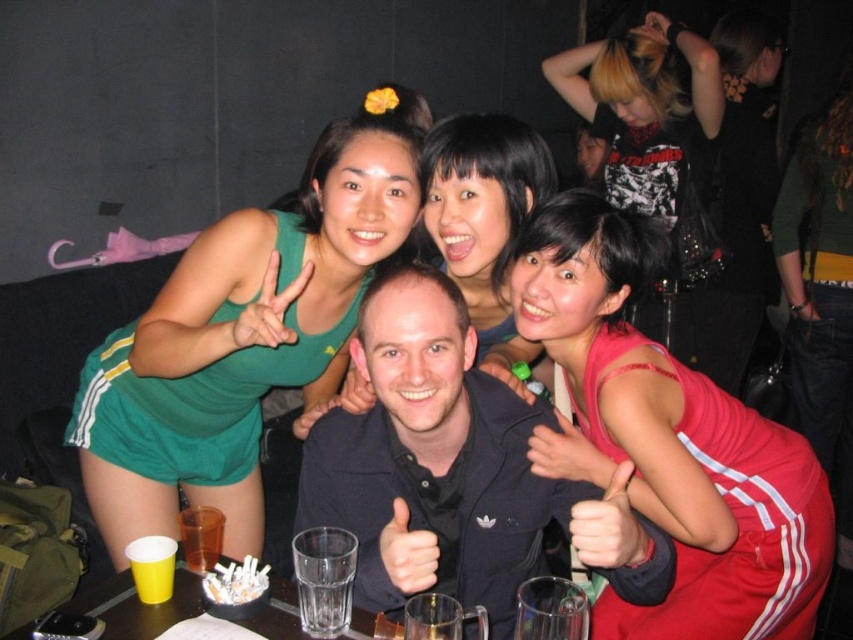
You are at the bar and want to take a photo of the red shiny dress at center. The bartender says you can only take the photo if you know its exact coordinates. What are the coordinates?

The coordinates of the red shiny dress at center are point (668,440).

From the picture: You are at a party and want to place a small snack on the green jersey at upper left or the translucent plastic cup at lower left. Which object can better accommodate the snack without it falling off?

The green jersey at upper left has a larger size compared to the translucent plastic cup at lower left, so it can better accommodate the snack without it falling off.